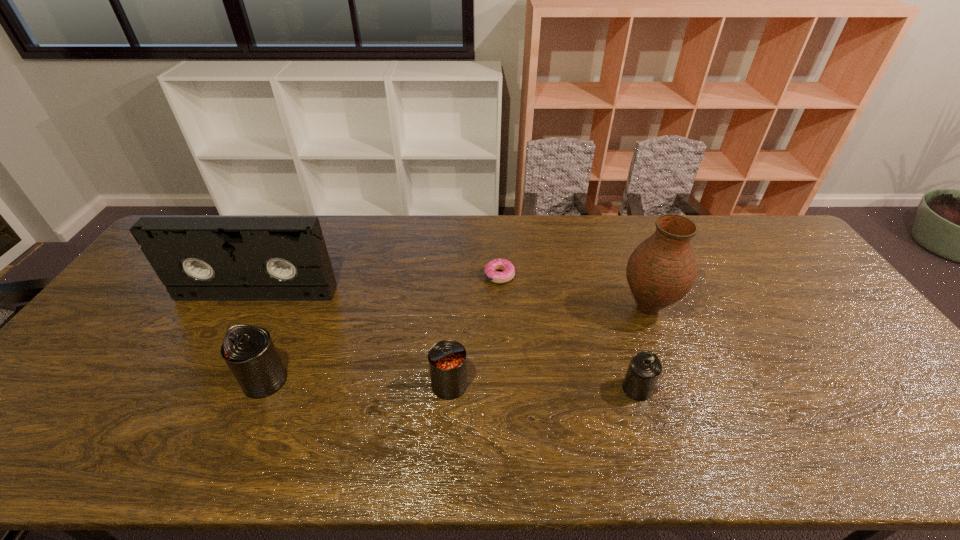
Locate an element on the screen. This screenshot has height=540, width=960. vacant region located 0.210m on the right of the leftmost can is located at coordinates (371, 380).

Identify the location of vacant area situated 0.370m on the back of the second can from left to right. Image resolution: width=960 pixels, height=540 pixels. (456, 273).

Where is `vacant space situated 0.400m on the right of the rightmost can`? vacant space situated 0.400m on the right of the rightmost can is located at coordinates (815, 388).

You are a GUI agent. You are given a task and a screenshot of the screen. Output one action in this format:
    pyautogui.click(x=<x>, y=<y>)
    Task: Click on the vacant space located on the back of the shortest object
    Image resolution: width=960 pixels, height=540 pixels.
    Given the screenshot: What is the action you would take?
    pyautogui.click(x=497, y=224)

Where is `vacant area situated 0.250m on the side of the videotape with visible spindles`? This screenshot has height=540, width=960. vacant area situated 0.250m on the side of the videotape with visible spindles is located at coordinates (216, 370).

The image size is (960, 540). In order to click on free location located 0.260m on the left of the vase in this screenshot , I will do `click(528, 308)`.

Locate an element on the screen. The width and height of the screenshot is (960, 540). object present at the left edge is located at coordinates (197, 258).

The height and width of the screenshot is (540, 960). In the image, there is a desktop. In order to click on vacant space at the far edge in this screenshot , I will do pyautogui.click(x=561, y=227).

Locate an element on the screen. vacant space at the left edge of the desktop is located at coordinates (143, 319).

You are a GUI agent. You are given a task and a screenshot of the screen. Output one action in this format:
    pyautogui.click(x=<x>, y=<y>)
    Task: Click on the free spot between the rightmost can and the vase
    The image size is (960, 540).
    Given the screenshot: What is the action you would take?
    pyautogui.click(x=642, y=348)